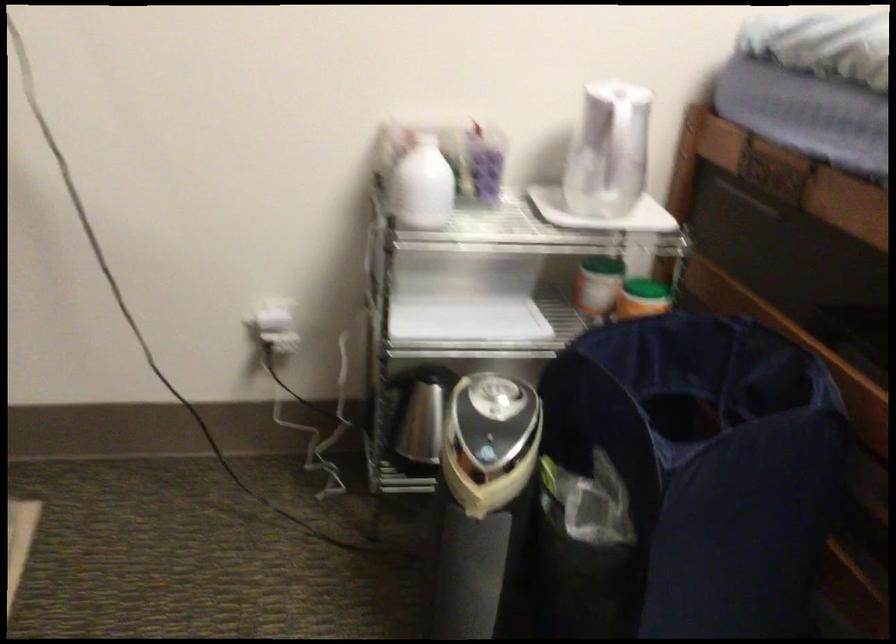
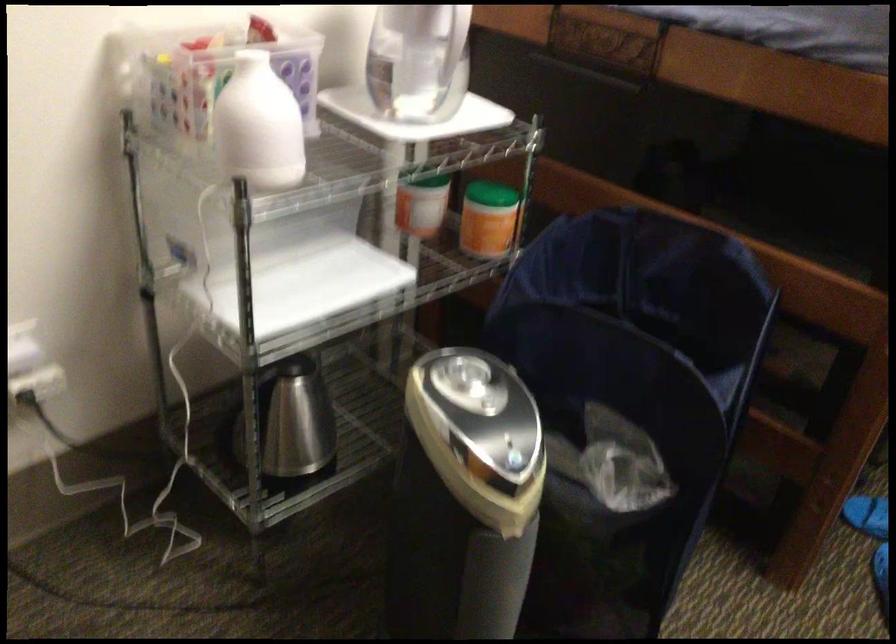
Question: The first image is from the beginning of the video and the second image is from the end. How did the camera likely rotate when shooting the video?

Choices:
 (A) Left
 (B) Right
 (C) Up
 (D) Down

Answer: (B)